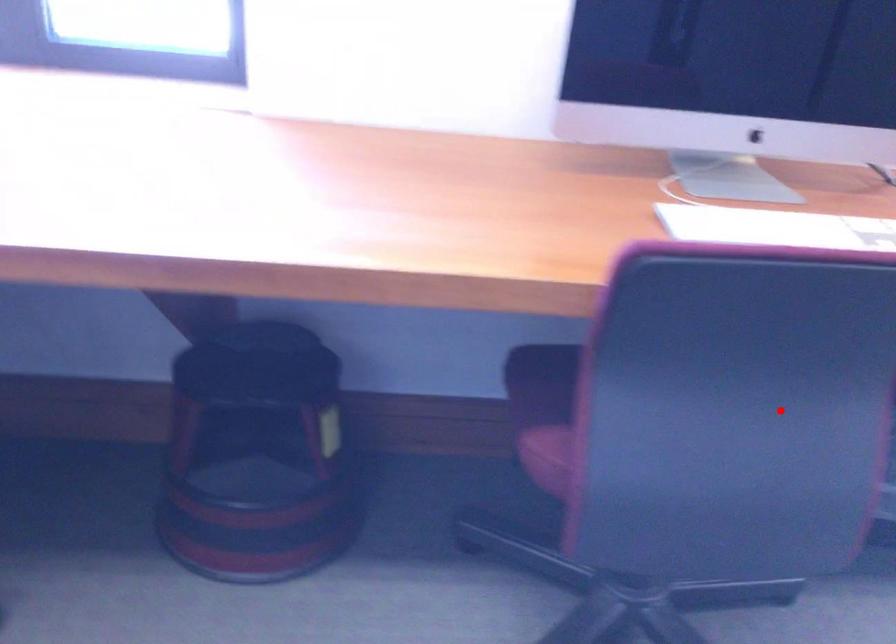
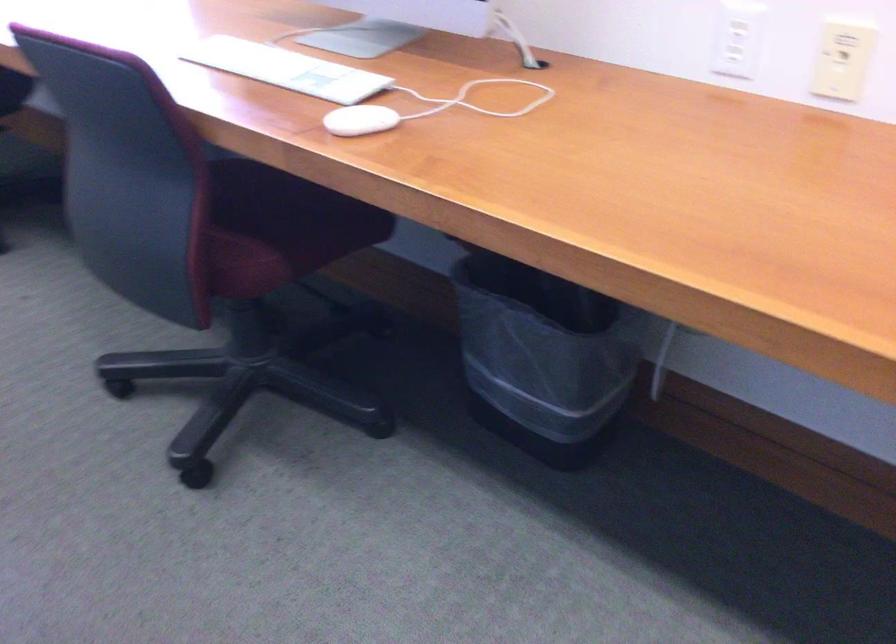
Question: I am providing you with two images of the same scene from different viewpoints. Image1 has a red point marked. In image2, the corresponding 3D location appears at what relative position? Reply with the corresponding letter.

Choices:
 (A) Closer
 (B) Farther

Answer: (B)